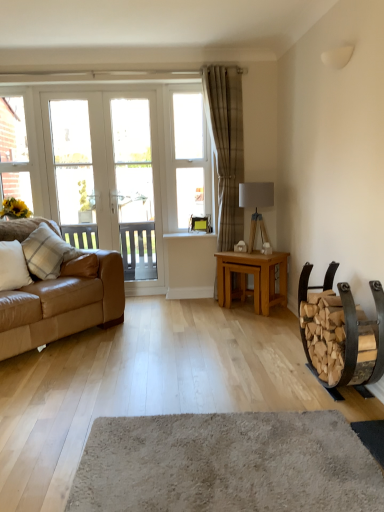
The width and height of the screenshot is (384, 512). I want to click on empty space that is ontop of soft beige carpet at center (from a real-world perspective), so click(207, 446).